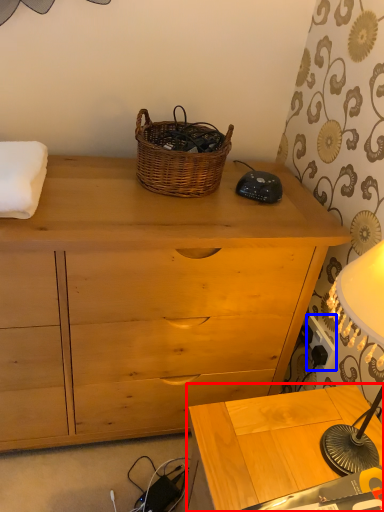
Question: Among these objects, which one is nearest to the camera, table (highlighted by a red box) or power outlet (highlighted by a blue box)?

Choices:
 (A) table
 (B) power outlet

Answer: (A)